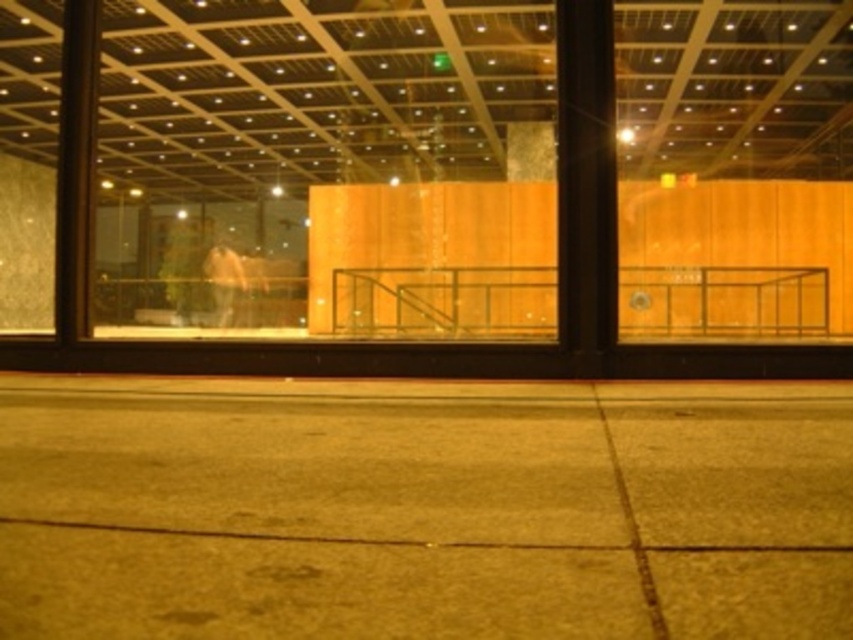
Question: Does concrete pavement at center come behind light brown leather jacket at center?

Choices:
 (A) yes
 (B) no

Answer: (B)

Question: Considering the relative positions of concrete pavement at center and light brown leather jacket at center in the image provided, where is concrete pavement at center located with respect to light brown leather jacket at center?

Choices:
 (A) below
 (B) above

Answer: (A)

Question: Does concrete pavement at center have a greater width compared to light brown leather jacket at center?

Choices:
 (A) yes
 (B) no

Answer: (A)

Question: Among these points, which one is farthest from the camera?

Choices:
 (A) (160, 624)
 (B) (218, 296)

Answer: (B)

Question: Among these objects, which one is farthest from the camera?

Choices:
 (A) light brown leather jacket at center
 (B) concrete pavement at center

Answer: (A)